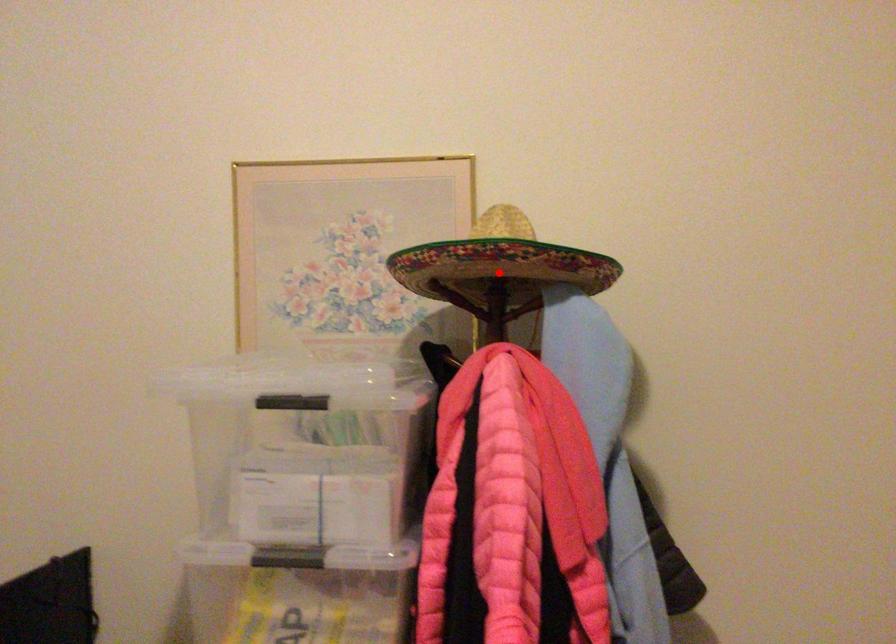
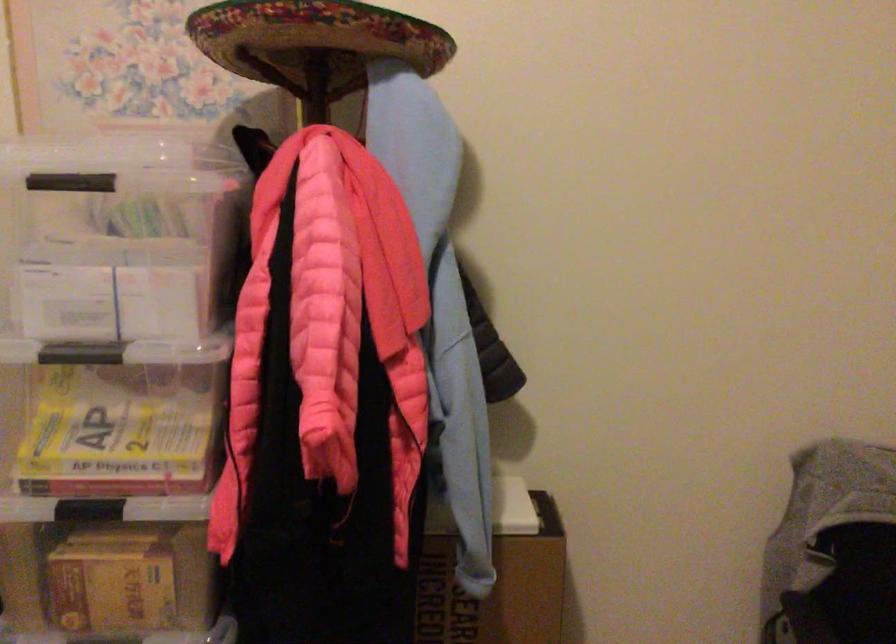
Question: A red point is marked in image1. In image2, is the corresponding 3D point closer to the camera or farther? Reply with the corresponding letter.

Choices:
 (A) The corresponding 3D point is closer.
 (B) The corresponding 3D point is farther.

Answer: (A)